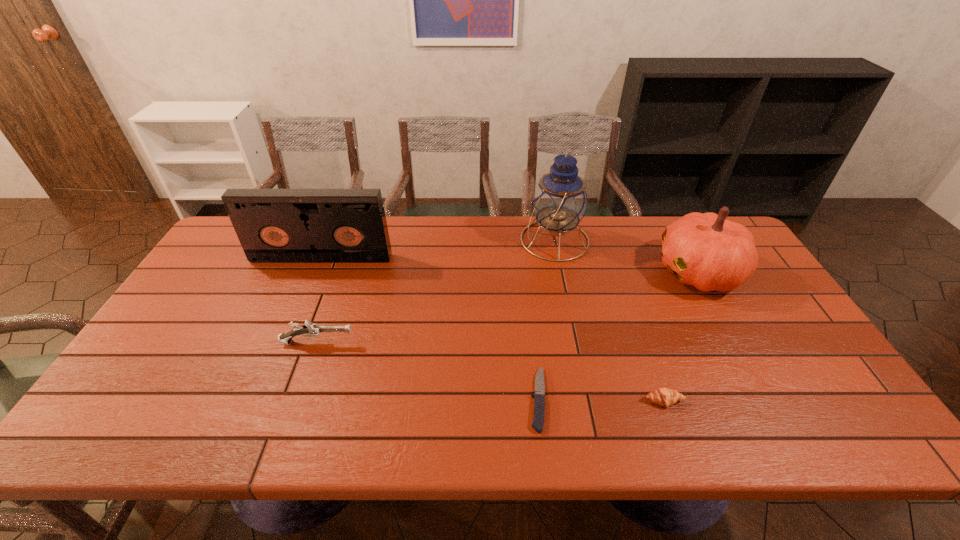
I want to click on lantern, so click(x=560, y=201).

At what (x,y) coordinates should I click in order to perform the action: click on videotape. Please return your answer as a coordinate pair (x, y). The height and width of the screenshot is (540, 960). Looking at the image, I should click on (273, 225).

You are a GUI agent. You are given a task and a screenshot of the screen. Output one action in this format:
    pyautogui.click(x=<x>, y=<y>)
    Task: Click on the rightmost object
    The height and width of the screenshot is (540, 960).
    Given the screenshot: What is the action you would take?
    pyautogui.click(x=705, y=250)

This screenshot has height=540, width=960. I want to click on the third nearest object, so click(311, 330).

This screenshot has width=960, height=540. What are the coordinates of `the third shortest object` in the screenshot? It's located at (311, 330).

Locate an element on the screen. The image size is (960, 540). pastry is located at coordinates (666, 397).

I want to click on the second shortest object, so click(666, 397).

At what (x,y) coordinates should I click in order to perform the action: click on steak knife. Please return your answer as a coordinate pair (x, y). Looking at the image, I should click on click(x=539, y=397).

Find the location of `free space located 0.110m on the front-facing side of the lantern`. free space located 0.110m on the front-facing side of the lantern is located at coordinates (488, 240).

Where is `vacant space located 0.070m on the front-facing side of the lantern`? vacant space located 0.070m on the front-facing side of the lantern is located at coordinates (499, 240).